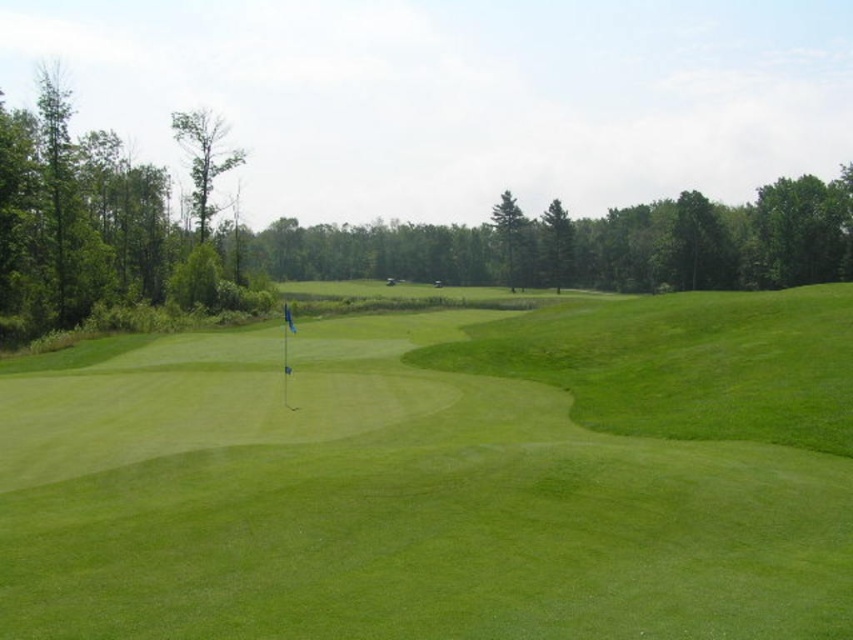
Question: Which point is closer to the camera taking this photo?

Choices:
 (A) (674, 296)
 (B) (567, 253)
 (C) (7, 132)
 (D) (523, 218)

Answer: (C)

Question: Can you confirm if green grassy golf course at center is bigger than green leafy tree at center?

Choices:
 (A) no
 (B) yes

Answer: (B)

Question: Considering the real-world distances, which object is farthest from the green leafy tree at left?

Choices:
 (A) smooth brown tree at upper left
 (B) green leafy tree at upper center

Answer: (B)

Question: Is smooth brown tree at upper left behind green leafy tree at center?

Choices:
 (A) yes
 (B) no

Answer: (B)

Question: Is smooth brown tree at upper left bigger than green textured tree at center?

Choices:
 (A) no
 (B) yes

Answer: (B)

Question: Which of the following is the closest to the observer?

Choices:
 (A) smooth brown tree at upper left
 (B) green grassy golf course at center
 (C) green leafy tree at left

Answer: (B)